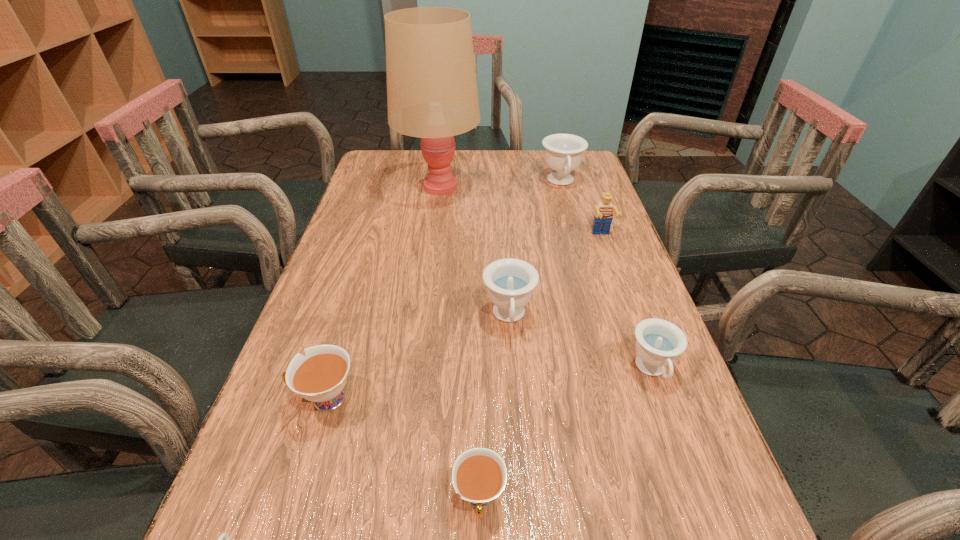
Select which blue teacup appears as the third closest to the tallest object. Please provide its 2D coordinates. Your answer should be formatted as a tuple, i.e. [(x, y)], where the tuple contains the x and y coordinates of a point satisfying the conditions above.

[(658, 342)]

Locate an element on the screen. The width and height of the screenshot is (960, 540). the fourth closest blue teacup to the third farthest object is located at coordinates click(224, 535).

Where is `vacant position in the image that satisfies the following two spatial constraints: 1. on the side of the second farthest teacup with the handle; 2. on the side of the farther white teacup with the handle`? This screenshot has height=540, width=960. vacant position in the image that satisfies the following two spatial constraints: 1. on the side of the second farthest teacup with the handle; 2. on the side of the farther white teacup with the handle is located at coordinates (515, 399).